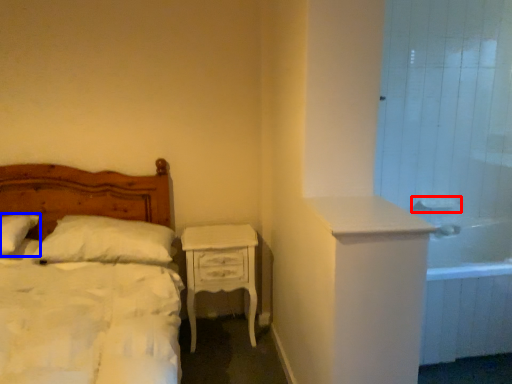
Question: Which of the following is the closest to the observer, sink (highlighted by a red box) or pillow (highlighted by a blue box)?

Choices:
 (A) sink
 (B) pillow

Answer: (B)